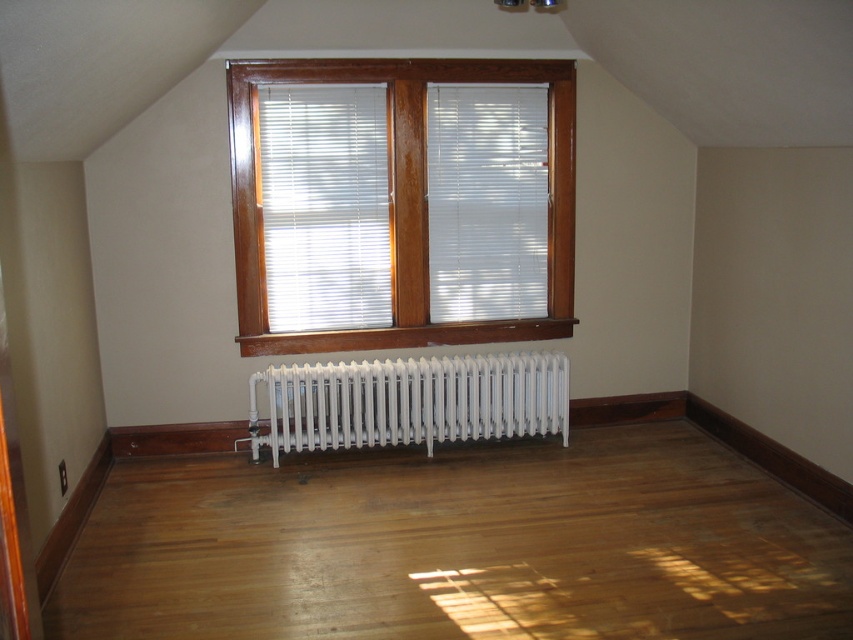
Who is taller, shiny brown hardwood floor at center or white wood blinds at center?

With more height is white wood blinds at center.

Who is higher up, shiny brown hardwood floor at center or white wood blinds at center?

Positioned higher is white wood blinds at center.

Image resolution: width=853 pixels, height=640 pixels. I want to click on shiny brown hardwood floor at center, so click(456, 545).

Is white wood blinds at center shorter than white metallic radiator at center?

Incorrect, white wood blinds at center's height does not fall short of white metallic radiator at center's.

Is white wood blinds at center closer to the viewer compared to white metallic radiator at center?

Yes, white wood blinds at center is closer to the viewer.

The height and width of the screenshot is (640, 853). I want to click on white wood blinds at center, so click(x=402, y=198).

Can you confirm if shiny brown hardwood floor at center is taller than white metallic radiator at center?

Yes, shiny brown hardwood floor at center is taller than white metallic radiator at center.

Is shiny brown hardwood floor at center below white metallic radiator at center?

Correct, shiny brown hardwood floor at center is located below white metallic radiator at center.

Where is `shiny brown hardwood floor at center`? The width and height of the screenshot is (853, 640). shiny brown hardwood floor at center is located at coordinates (456, 545).